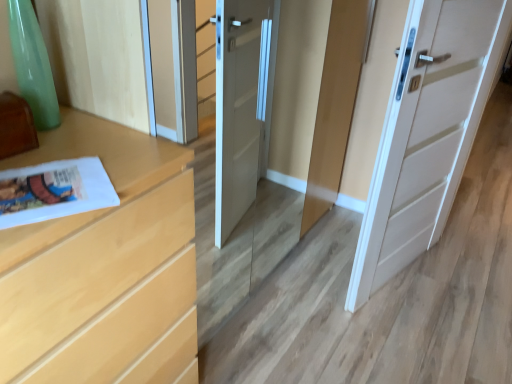
The height and width of the screenshot is (384, 512). What do you see at coordinates (426, 132) in the screenshot?
I see `white matte door at center` at bounding box center [426, 132].

Where is `white matte door at center`? white matte door at center is located at coordinates (426, 132).

Is light wood chest of drawers at left not near white glossy magazine at lower left?

light wood chest of drawers at left is near white glossy magazine at lower left, not far away.

How many degrees apart are the facing directions of light wood chest of drawers at left and white glossy magazine at lower left?

59.8 degrees.

Is light wood chest of drawers at left completely or partially outside of white glossy magazine at lower left?

Yes, light wood chest of drawers at left is located beyond the bounds of white glossy magazine at lower left.

In terms of size, does light wood chest of drawers at left appear bigger or smaller than white glossy magazine at lower left?

Considering their sizes, light wood chest of drawers at left takes up more space than white glossy magazine at lower left.

Is light wood chest of drawers at left shorter than white matte door at center?

Yes.

Who is more distant, light wood chest of drawers at left or white matte door at center?

white matte door at center is more distant.

Can you confirm if light wood chest of drawers at left is positioned to the right of white matte door at center?

In fact, light wood chest of drawers at left is to the left of white matte door at center.

Looking at this image, is light wood chest of drawers at left thinner than white matte door at center?

Incorrect, the width of light wood chest of drawers at left is not less than that of white matte door at center.

Is point (400, 250) positioned in front of point (101, 190)?

No, it is not.

Is white matte door at center not near white glossy magazine at lower left?

white matte door at center is far away from white glossy magazine at lower left.

From a real-world perspective, does white matte door at center stand above white glossy magazine at lower left?

No, from a real-world perspective, white matte door at center is not over white glossy magazine at lower left

How different are the orientations of white matte door at center and white glossy magazine at lower left in degrees?

The angle between the facing direction of white matte door at center and the facing direction of white glossy magazine at lower left is 73.4 degrees.

Does white glossy magazine at lower left appear on the left side of light wood chest of drawers at left?

A: No.

Does white glossy magazine at lower left touch light wood chest of drawers at left?

No, white glossy magazine at lower left is not next to light wood chest of drawers at left.

Do you think white glossy magazine at lower left is within light wood chest of drawers at left, or outside of it?

white glossy magazine at lower left fits inside light wood chest of drawers at left.

Could you tell me if white glossy magazine at lower left is turned towards light wood chest of drawers at left?

Yes, white glossy magazine at lower left is turned towards light wood chest of drawers at left.

Looking at this image, from the image's perspective, which one is positioned higher, white glossy magazine at lower left or white matte door at center?

white matte door at center appears higher in the image.

Does white glossy magazine at lower left appear on the right side of white matte door at center?

In fact, white glossy magazine at lower left is to the left of white matte door at center.

Is white glossy magazine at lower left next to white matte door at center?

There is a gap between white glossy magazine at lower left and white matte door at center.

How distant is white glossy magazine at lower left from white matte door at center?

1.40 meters.

Does white matte door at center come behind light wood chest of drawers at left?

Yes, the depth of white matte door at center is greater than that of light wood chest of drawers at left.

Between white matte door at center and light wood chest of drawers at left, which one appears on the right side from the viewer's perspective?

white matte door at center.

From the image's perspective, is white matte door at center on light wood chest of drawers at left?

Correct, white matte door at center appears higher than light wood chest of drawers at left in the image.

Find the location of a particular element. door above the light wood chest of drawers at left (from the image's perspective) is located at coordinates (426, 132).

This screenshot has height=384, width=512. What are the coordinates of `magazine on the right of light wood chest of drawers at left` in the screenshot? It's located at (54, 191).

Where is `the chest of drawers that appears in front of the white matte door at center`? The width and height of the screenshot is (512, 384). the chest of drawers that appears in front of the white matte door at center is located at coordinates pos(103,268).

Considering their positions, is white glossy magazine at lower left positioned further to light wood chest of drawers at left than white matte door at center?

Based on the image, white matte door at center appears to be further to light wood chest of drawers at left.

Looking at the image, which one is located further to white glossy magazine at lower left, white matte door at center or light wood chest of drawers at left?

white matte door at center lies further to white glossy magazine at lower left than the other object.

Looking at the image, which one is located closer to white matte door at center, white glossy magazine at lower left or light wood chest of drawers at left?

The object closer to white matte door at center is light wood chest of drawers at left.

When comparing their distances from light wood chest of drawers at left, does white matte door at center or white glossy magazine at lower left seem closer?

white glossy magazine at lower left is closer to light wood chest of drawers at left.

Based on their spatial positions, is light wood chest of drawers at left or white matte door at center further from white glossy magazine at lower left?

white matte door at center lies further to white glossy magazine at lower left than the other object.

Based on their spatial positions, is light wood chest of drawers at left or white glossy magazine at lower left further from white matte door at center?

Among the two, white glossy magazine at lower left is located further to white matte door at center.

You are a GUI agent. You are given a task and a screenshot of the screen. Output one action in this format:
    pyautogui.click(x=<x>, y=<y>)
    Task: Click on the magazine between light wood chest of drawers at left and white matte door at center in the horizontal direction
    
    Given the screenshot: What is the action you would take?
    pyautogui.click(x=54, y=191)